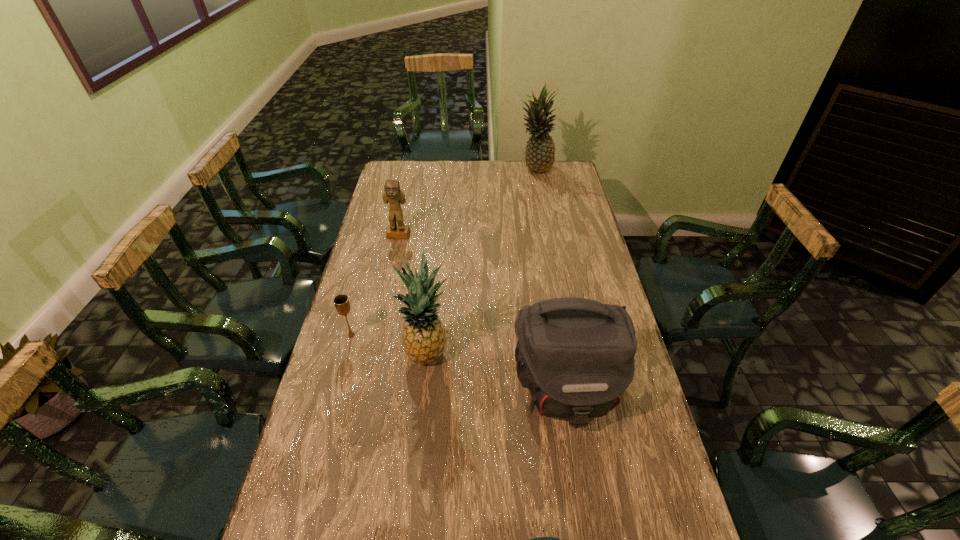
Locate an element on the screen. The height and width of the screenshot is (540, 960). vacant region located 0.190m on the left of the fourth object from right to left is located at coordinates (342, 353).

The height and width of the screenshot is (540, 960). I want to click on vacant area situated on the open flap of the shoulder bag, so click(588, 532).

Identify the location of free space located on the front-facing side of the second farthest object. (391, 272).

The image size is (960, 540). I want to click on free location located 0.300m on the back of the chalice, so click(x=370, y=267).

Find the location of a particular element. The width and height of the screenshot is (960, 540). object situated at the far edge is located at coordinates (539, 156).

The height and width of the screenshot is (540, 960). I want to click on figurine that is at the left edge, so click(x=392, y=193).

This screenshot has height=540, width=960. Find the location of `chalice that is at the left edge`. chalice that is at the left edge is located at coordinates (342, 304).

Identify the location of pineapple at the right edge. The width and height of the screenshot is (960, 540). (539, 156).

The width and height of the screenshot is (960, 540). What are the coordinates of `shoulder bag that is positioned at the right edge` in the screenshot? It's located at (576, 355).

What are the coordinates of `object at the far right corner` in the screenshot? It's located at (539, 156).